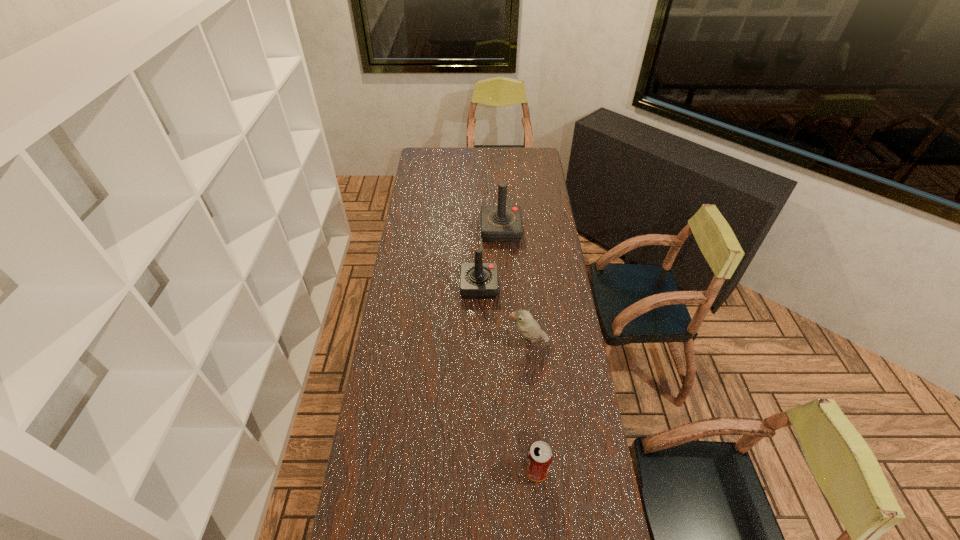
What are the coordinates of `object identified as the second closest to the shortest object` in the screenshot? It's located at (478, 280).

Choose which object is the second nearest neighbor to the farthest object. Please provide its 2D coordinates. Your answer should be formatted as a tuple, i.e. [(x, y)], where the tuple contains the x and y coordinates of a point satisfying the conditions above.

[(528, 327)]

Locate an element on the screen. vacant space that satisfies the following two spatial constraints: 1. on the front-facing side of the third nearest object; 2. on the back side of the shortest object is located at coordinates (479, 470).

Find the location of `blank space that satisfies the following two spatial constraints: 1. on the back side of the nearest object; 2. on the rectangular base of the farther joystick`. blank space that satisfies the following two spatial constraints: 1. on the back side of the nearest object; 2. on the rectangular base of the farther joystick is located at coordinates (516, 230).

Identify the location of free space that satisfies the following two spatial constraints: 1. on the front-facing side of the soda can; 2. on the left side of the third nearest object. (479, 470).

Locate an element on the screen. vacant space that satisfies the following two spatial constraints: 1. on the rectangular base of the nearest object; 2. on the left side of the farther joystick is located at coordinates (513, 470).

This screenshot has height=540, width=960. Identify the location of vacant position in the image that satisfies the following two spatial constraints: 1. on the rectangular base of the tallest object; 2. on the back side of the shortest object. (513, 470).

The height and width of the screenshot is (540, 960). Identify the location of blank space that satisfies the following two spatial constraints: 1. on the front-facing side of the soda can; 2. on the right side of the third nearest object. (479, 470).

This screenshot has height=540, width=960. Find the location of `free space that satisfies the following two spatial constraints: 1. on the rectangular base of the farther joystick; 2. on the right side of the shortest object`. free space that satisfies the following two spatial constraints: 1. on the rectangular base of the farther joystick; 2. on the right side of the shortest object is located at coordinates (513, 470).

The width and height of the screenshot is (960, 540). I want to click on vacant space that satisfies the following two spatial constraints: 1. on the front-facing side of the shortest object; 2. on the left side of the second farthest object, so click(479, 470).